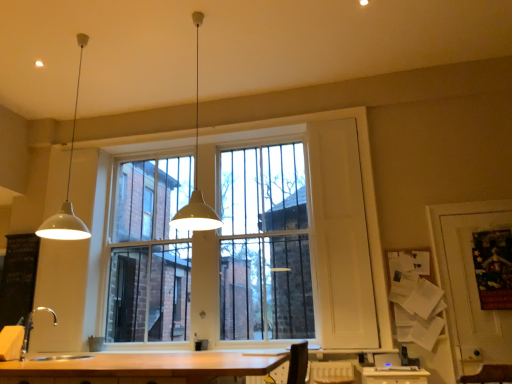
Question: Is white glass window at center far away from black chalkboard at left?

Choices:
 (A) no
 (B) yes

Answer: (B)

Question: Does white glass window at center have a smaller size compared to black chalkboard at left?

Choices:
 (A) yes
 (B) no

Answer: (B)

Question: Is white glass window at center to the right of black chalkboard at left from the viewer's perspective?

Choices:
 (A) yes
 (B) no

Answer: (A)

Question: Can you confirm if white glass window at center is taller than black chalkboard at left?

Choices:
 (A) yes
 (B) no

Answer: (A)

Question: Considering the relative sizes of white glass window at center and black chalkboard at left in the image provided, is white glass window at center shorter than black chalkboard at left?

Choices:
 (A) yes
 (B) no

Answer: (B)

Question: Is white glass window at center thinner than black chalkboard at left?

Choices:
 (A) no
 (B) yes

Answer: (B)

Question: From the image's perspective, is black chalkboard at left on top of white matte pendant light at center, marked as the first lamp in a right-to-left arrangement?

Choices:
 (A) no
 (B) yes

Answer: (A)

Question: Is black chalkboard at left turned away from white matte pendant light at center, the second lamp in the left-to-right sequence?

Choices:
 (A) no
 (B) yes

Answer: (A)

Question: Would you say black chalkboard at left is outside white matte pendant light at center, marked as the first lamp in a right-to-left arrangement?

Choices:
 (A) yes
 (B) no

Answer: (A)

Question: Considering the relative sizes of black chalkboard at left and white matte pendant light at center, the second lamp in the left-to-right sequence, in the image provided, is black chalkboard at left thinner than white matte pendant light at center, the second lamp in the left-to-right sequence,?

Choices:
 (A) yes
 (B) no

Answer: (A)

Question: Is black chalkboard at left directly adjacent to white matte pendant light at center, marked as the first lamp in a right-to-left arrangement?

Choices:
 (A) yes
 (B) no

Answer: (B)

Question: Does black chalkboard at left turn towards white matte pendant light at center, marked as the first lamp in a right-to-left arrangement?

Choices:
 (A) yes
 (B) no

Answer: (B)

Question: Can you confirm if white glass window at center is thinner than white matte pendant light at center, marked as the first lamp in a right-to-left arrangement?

Choices:
 (A) no
 (B) yes

Answer: (B)